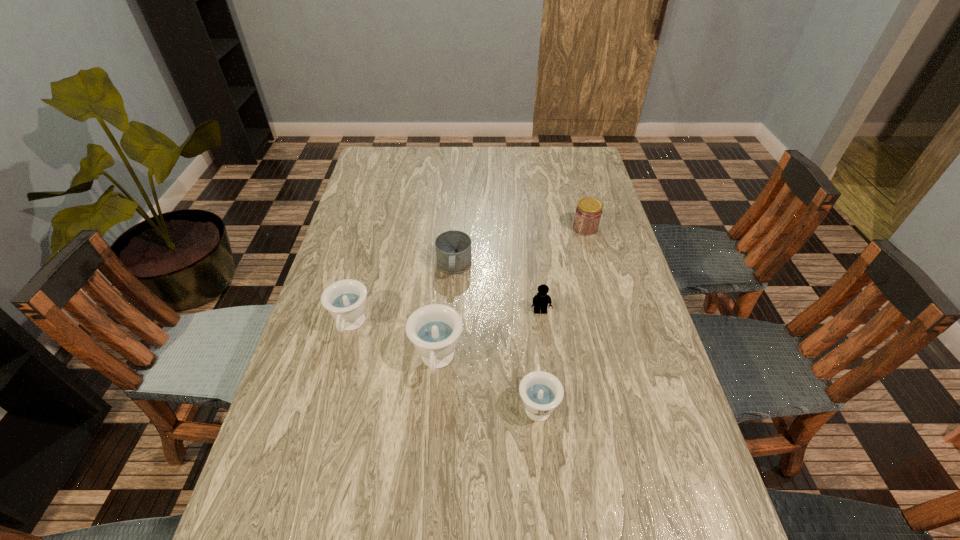
In the current image, all teacups are evenly spaced. To maintain this equal spacing, where should an additional teacup be placed on the right? Please point out a free spot. Please provide its 2D coordinates. Your answer should be formatted as a tuple, i.e. [(x, y)], where the tuple contains the x and y coordinates of a point satisfying the conditions above.

[(655, 453)]